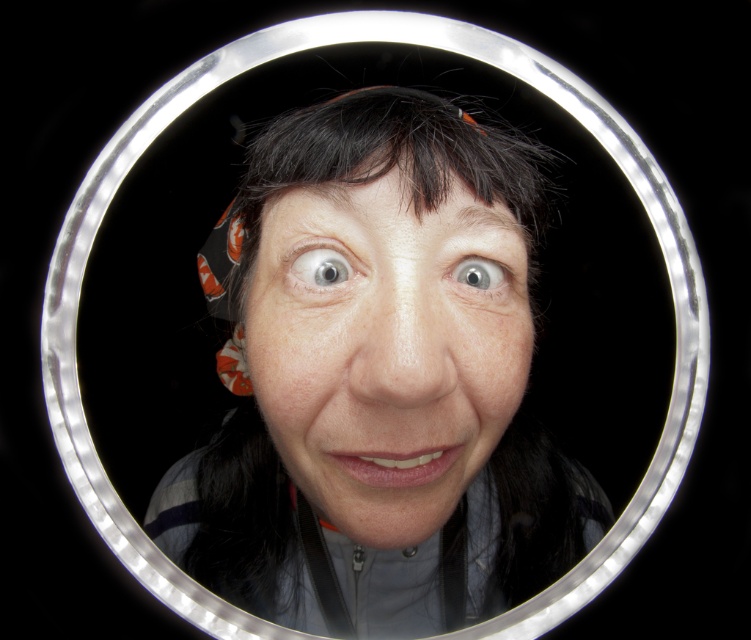
Question: Is smooth skin face at center further to the viewer compared to light blue glossy eye at upper center?

Choices:
 (A) yes
 (B) no

Answer: (B)

Question: In this image, where is smooth skin face at center located relative to light blue glossy eye at upper center?

Choices:
 (A) below
 (B) above

Answer: (A)

Question: Which point is farther to the camera?

Choices:
 (A) (327, 278)
 (B) (472, 282)
 (C) (382, 392)

Answer: (B)

Question: Which point is closer to the camera taking this photo?

Choices:
 (A) (318, 272)
 (B) (451, 380)
 (C) (499, 273)

Answer: (B)

Question: Is smooth skin face at center wider than light blue glossy eye at upper center?

Choices:
 (A) no
 (B) yes

Answer: (B)

Question: Which point is farther from the camera taking this photo?

Choices:
 (A) (330, 260)
 (B) (439, 360)
 (C) (493, 284)

Answer: (C)